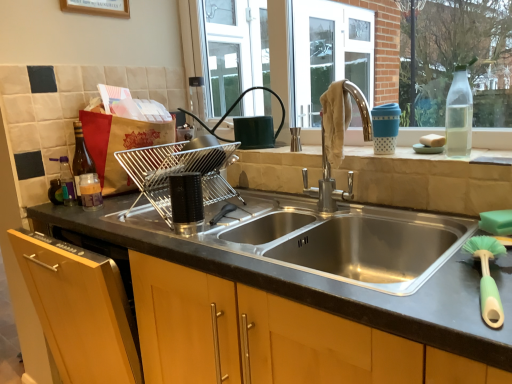
The image size is (512, 384). In order to click on free space to the left of black plastic dish rack at center, marked as the second appliance in a back-to-front arrangement in this screenshot , I will do `click(132, 224)`.